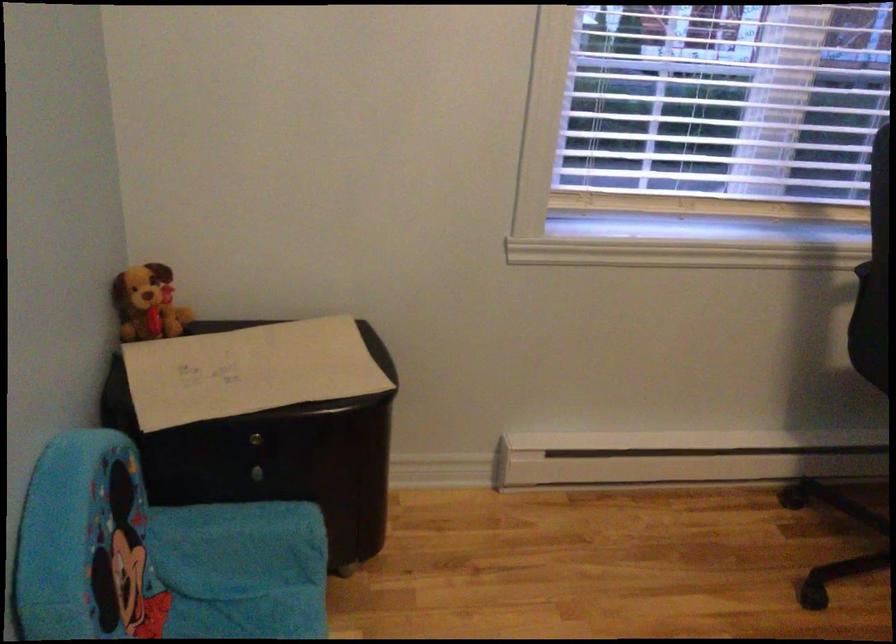
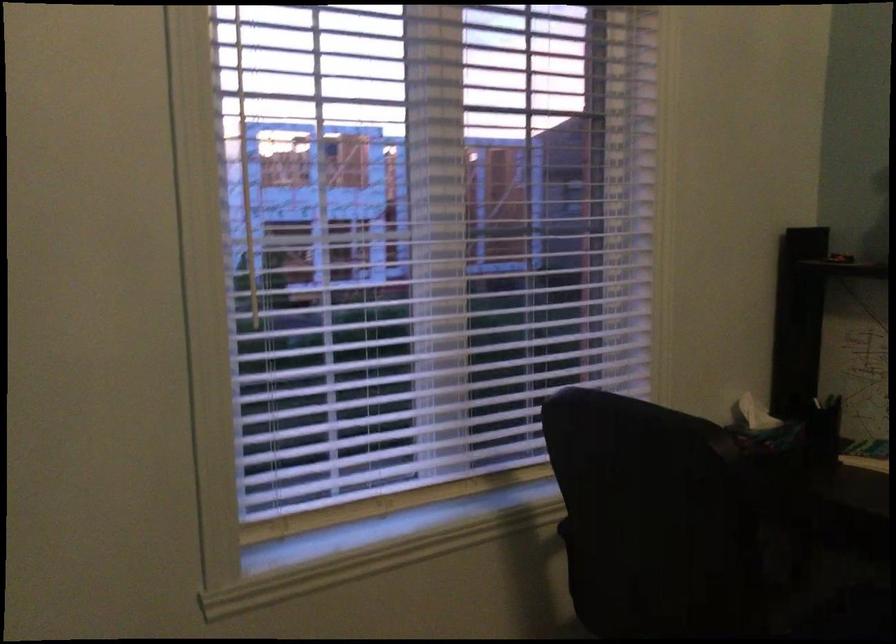
Which direction would the cameraman need to move to produce the second image?

The cameraman moved toward right, forward.